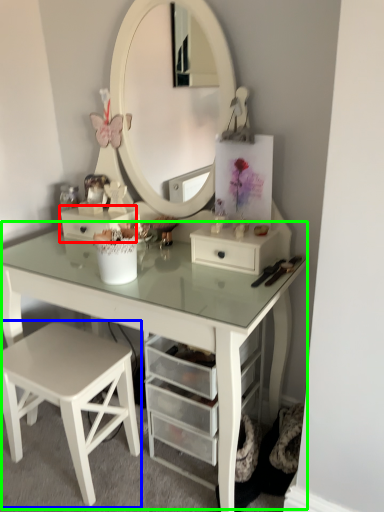
Question: Which is nearer to the drawer (highlighted by a red box)? stool (highlighted by a blue box) or table (highlighted by a green box).

Choices:
 (A) stool
 (B) table

Answer: (B)